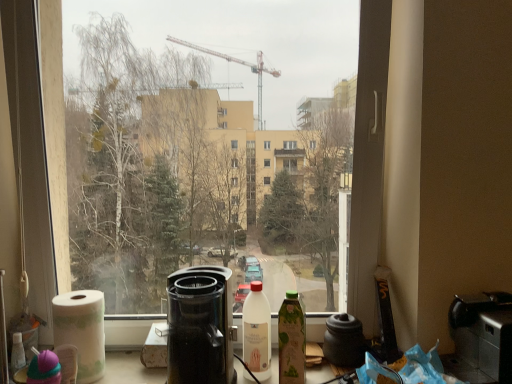
Question: Based on their positions, is transparent glass window at center located to the left or right of matte black coffeepot at center?

Choices:
 (A) right
 (B) left

Answer: (B)

Question: From the image's perspective, is transparent glass window at center positioned above or below matte black coffeepot at center?

Choices:
 (A) above
 (B) below

Answer: (A)

Question: Based on their relative distances, which object is nearer to the white matte bottle at center, the 1th bottle viewed from the left?

Choices:
 (A) green glass bottle at center, the second bottle in the left-to-right sequence
 (B) transparent glass window at center
 (C) matte black coffeepot at center
 (D) white paper towel at lower left
 (E) black plastic coffee maker at center, which ranks as the second appliance in right-to-left order

Answer: (A)

Question: Considering the real-world distances, which object is closest to the transparent glass window at center?

Choices:
 (A) black plastic toaster at lower right, the 1th appliance in the right-to-left sequence
 (B) matte black coffeepot at center
 (C) white matte bottle at center, which is the 2th bottle from right to left
 (D) green glass bottle at center, which is the 1th bottle in right-to-left order
 (E) black plastic coffee maker at center, which ranks as the 1th appliance in left-to-right order

Answer: (E)